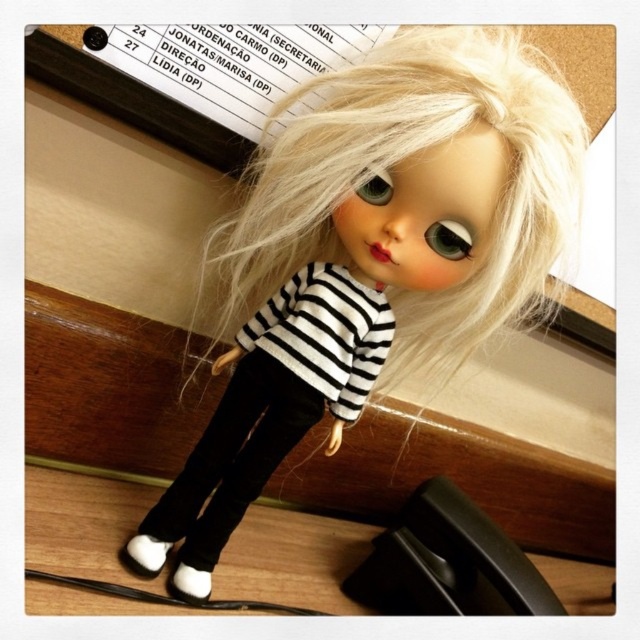
You are a photographer setting up a shoot with the doll. You want to place a small prop between the white matte shoe at lower left and the white matte shoe at lower center. Which shoe should the prop be closer to to ensure it fits between them?

The prop should be closer to the white matte shoe at lower center because it is smaller than the white matte shoe at lower left, so placing it near the smaller shoe allows for better spacing between the two shoes.

You are a photographer adjusting your camera settings to capture the white matte shoe at lower left and the white matte shoe at lower center. Which shoe should you focus on to ensure it appears clearer in the photo if you want the one farther away to be sharp?

You should focus on the white matte shoe at lower center because it is farther away from the viewer than the white matte shoe at lower left, and focusing on the farther object ensures both will be sharp if within the depth of field.